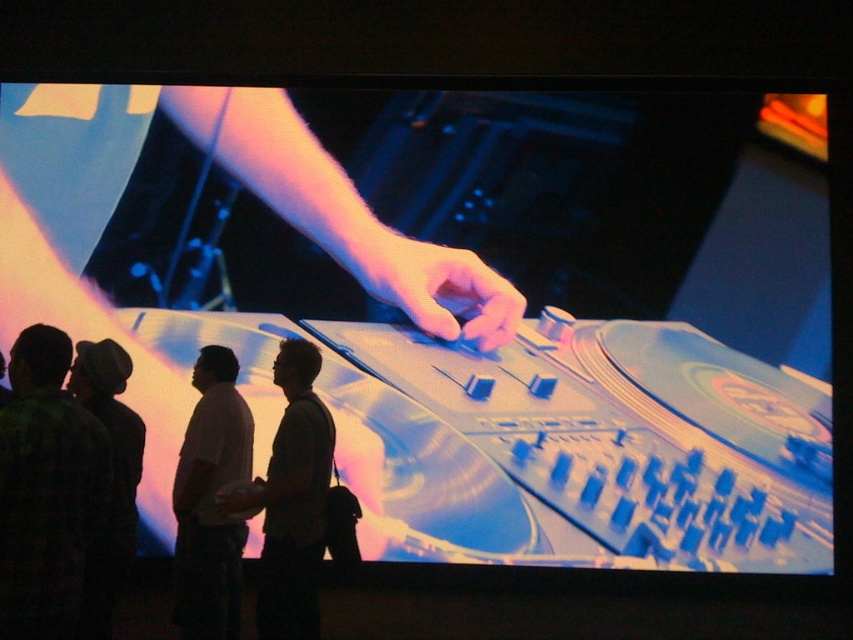
Who is more distant from viewer, (292, 493) or (370, 264)?

Positioned behind is point (370, 264).

Does dark gray shirt at center have a lesser height compared to pink matte hand at center?

Incorrect, dark gray shirt at center's height does not fall short of pink matte hand at center's.

Describe the element at coordinates (292, 499) in the screenshot. I see `dark gray shirt at center` at that location.

Locate an element on the screen. dark gray shirt at center is located at coordinates (292, 499).

Does green plaid shirt at lower left have a smaller size compared to dark gray shirt at center?

Actually, green plaid shirt at lower left might be larger than dark gray shirt at center.

Where is `green plaid shirt at lower left`? green plaid shirt at lower left is located at coordinates (45, 490).

Which is behind, point (0, 515) or point (270, 618)?

The point (270, 618) is more distant.

The height and width of the screenshot is (640, 853). I want to click on green plaid shirt at lower left, so click(x=45, y=490).

Is white matte shirt at lower left bigger than matte black hand at center?

Yes, white matte shirt at lower left is bigger than matte black hand at center.

Based on the photo, is white matte shirt at lower left below matte black hand at center?

No, white matte shirt at lower left is not below matte black hand at center.

The width and height of the screenshot is (853, 640). Describe the element at coordinates (210, 500) in the screenshot. I see `white matte shirt at lower left` at that location.

I want to click on white matte shirt at lower left, so click(x=210, y=500).